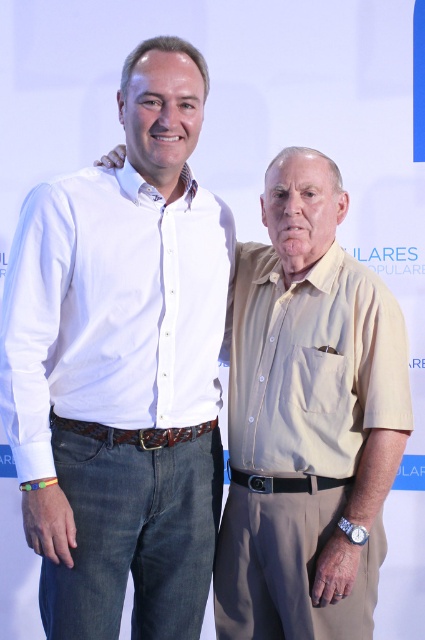
From the picture: Is white cotton shirt at upper left below matte khaki shirt at right?

Incorrect, white cotton shirt at upper left is not positioned below matte khaki shirt at right.

Does point (144, 68) come behind point (320, 200)?

No, (144, 68) is in front of (320, 200).

Is point (215, 448) farther from viewer compared to point (331, 604)?

Yes.

Find the location of `white cotton shirt at upper left`. white cotton shirt at upper left is located at coordinates (122, 365).